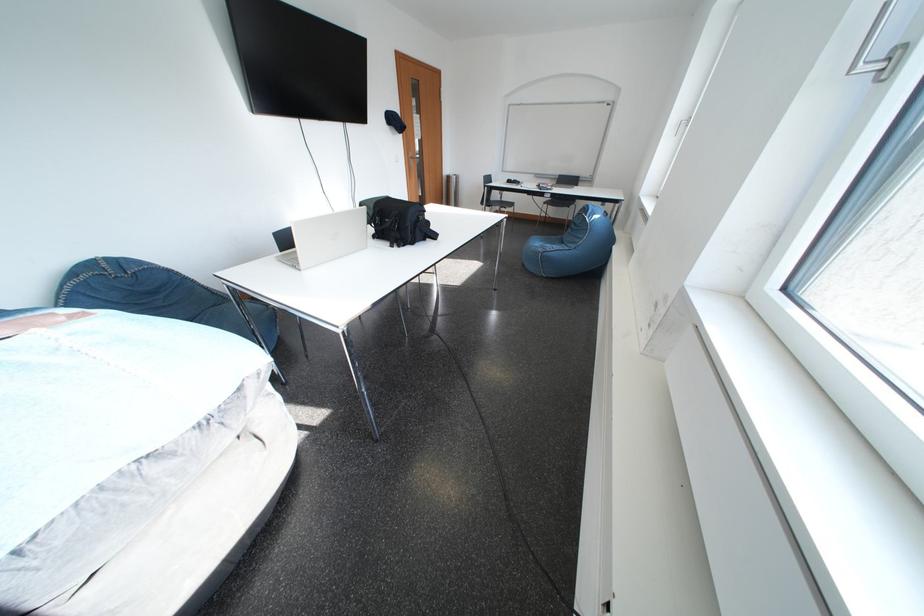
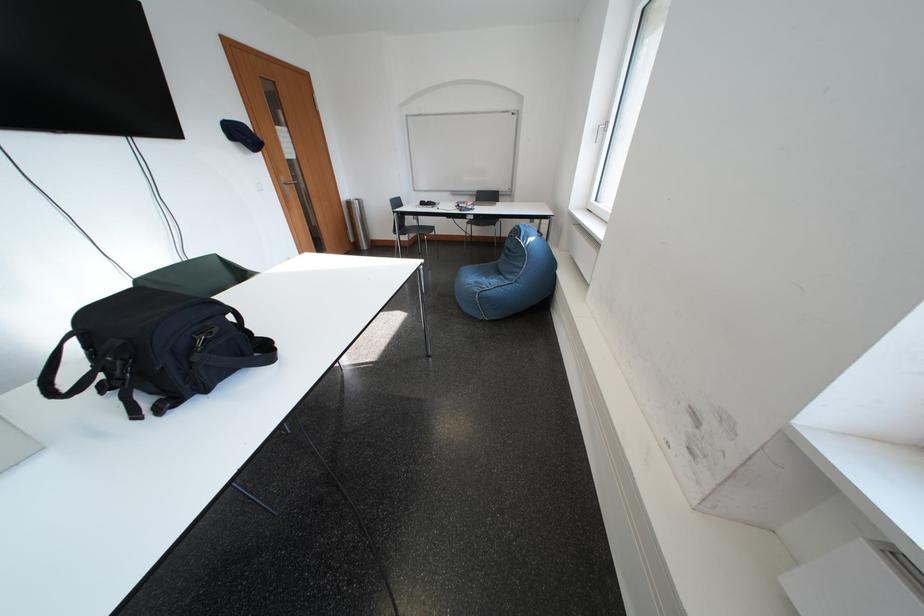
Locate, in the second image, the point that corresponds to point 563,246 in the first image.

(497, 278)